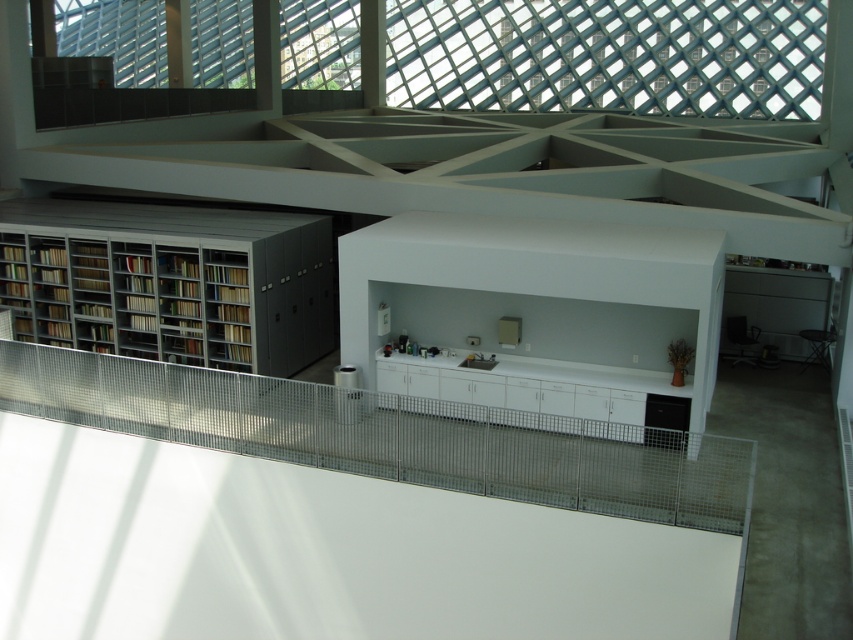
You are standing in the room and want to know if you can throw a ball from the matte gray bookcase at left to the transparent glass window at upper center. The ball can travel 25 meters. Will it reach?

The transparent glass window at upper center is 24.38 meters from the matte gray bookcase at left, so yes, the ball can reach it since the distance is within the ball travel range of 25 meters.

You are standing in the room and want to look outside through the transparent glass window at upper center. To do so, should you turn towards the direction of the matte gray bookcase at left or away from it?

You should turn towards the direction of the matte gray bookcase at left because the transparent glass window at upper center is located to the right of the matte gray bookcase at left, meaning it is in the opposite direction of the bookcase.

You are planning to install a new air conditioning unit that requires a space of at least 1.5 meters in width. Given the transparent glass window at upper center and the matte gray bookcase at left, which object provides sufficient space for the installation?

The transparent glass window at upper center has a larger size compared to the matte gray bookcase at left, so it can provide sufficient space for the air conditioning unit requiring at least 1.5 meters in width.